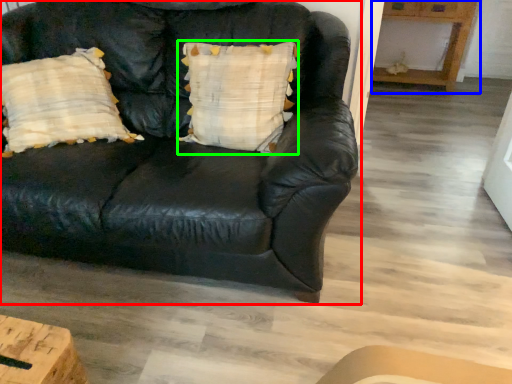
Question: Based on their relative distances, which object is farther from studio couch (highlighted by a red box)? Choose from table (highlighted by a blue box) and pillow (highlighted by a green box).

Choices:
 (A) table
 (B) pillow

Answer: (A)